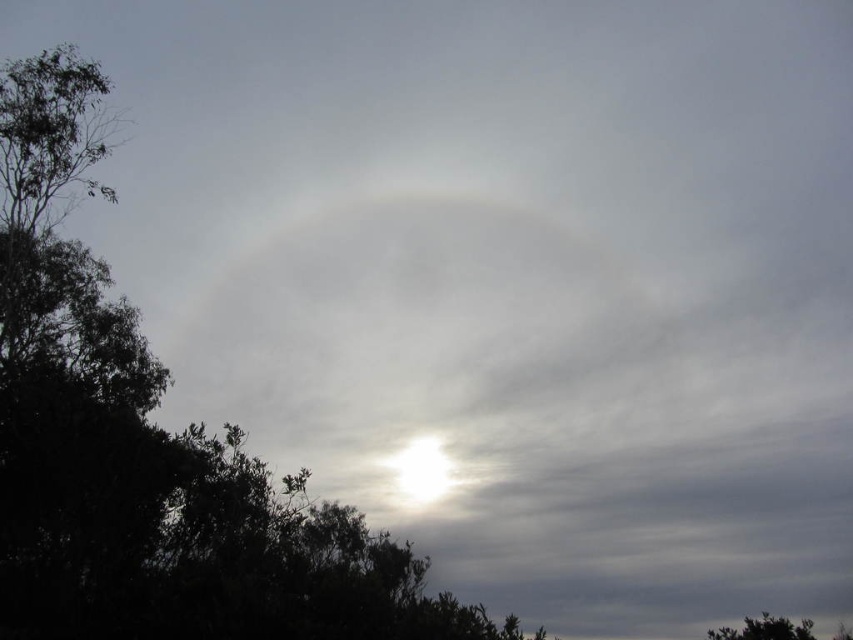
Can you confirm if green leafy tree at upper left is shorter than green leafy tree at lower right?

Incorrect, green leafy tree at upper left's height does not fall short of green leafy tree at lower right's.

Does point (15, 397) come farther from viewer compared to point (770, 636)?

That is False.

This screenshot has width=853, height=640. I want to click on green leafy tree at upper left, so click(149, 449).